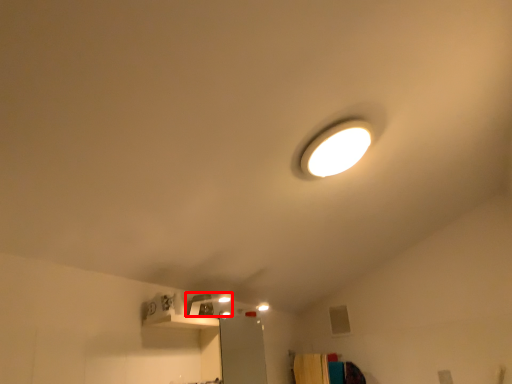
Question: From the image's perspective, where is lamp (annotated by the red box) located in relation to furniture in the image?

Choices:
 (A) above
 (B) below

Answer: (A)